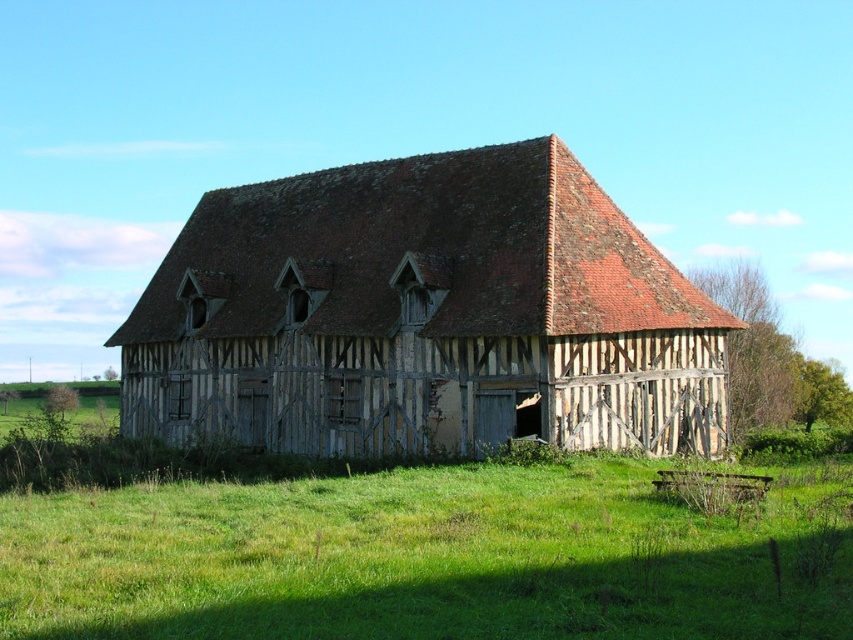
Question: Can you confirm if weathered wood barn at center is smaller than green grass at center?

Choices:
 (A) yes
 (B) no

Answer: (B)

Question: Is weathered wood barn at center positioned behind green grass at center?

Choices:
 (A) yes
 (B) no

Answer: (A)

Question: Is the position of weathered wood barn at center less distant than that of green grass at center?

Choices:
 (A) no
 (B) yes

Answer: (A)